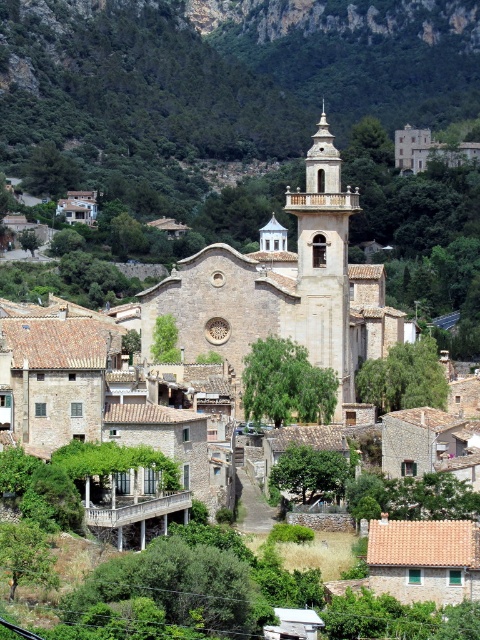
Between green leafy mountain at upper center and light beige stone church at center, which one appears on the right side from the viewer's perspective?

Positioned to the right is light beige stone church at center.

Is green leafy mountain at upper center below light beige stone church at center?

No, green leafy mountain at upper center is not below light beige stone church at center.

You are a GUI agent. You are given a task and a screenshot of the screen. Output one action in this format:
    pyautogui.click(x=<x>, y=<y>)
    Task: Click on the green leafy mountain at upper center
    This screenshot has width=480, height=640.
    Given the screenshot: What is the action you would take?
    pyautogui.click(x=226, y=74)